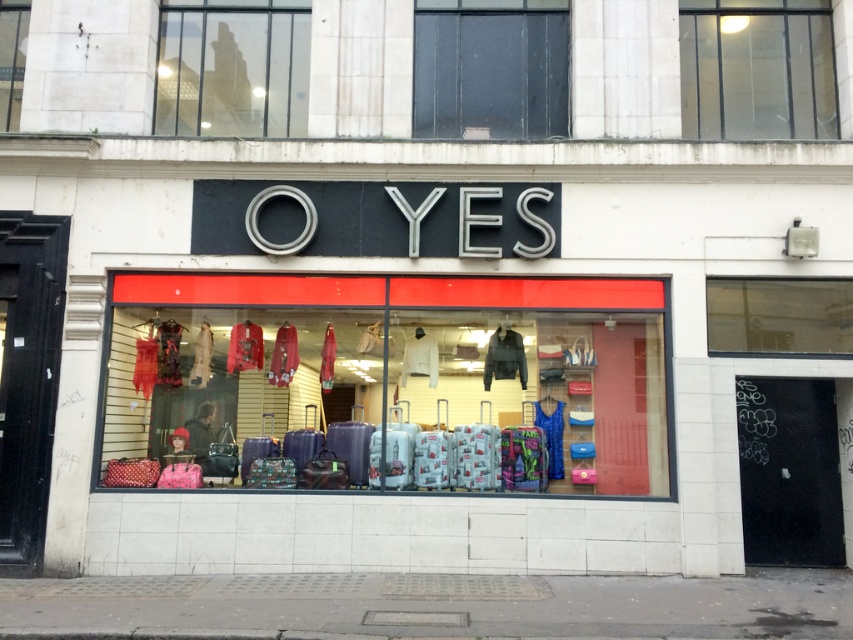
You are standing outside the YES store looking at the window display. There are two points marked on the window glass. One is at coordinate point (469, 13) and the other is at point (167, 1). Which point is closer to your eyes?

Point (469, 13) is closer to the camera than point (167, 1).

You are a delivery person carrying a package that is 5 meters long. You need to place it between the transparent glass at upper right and the transparent glass at upper left. Can the package fit in the space between them?

The transparent glass at upper right is 5.39 meters from transparent glass at upper left. Since the package is 5 meters long, it can fit in the space between them as the distance is sufficient.